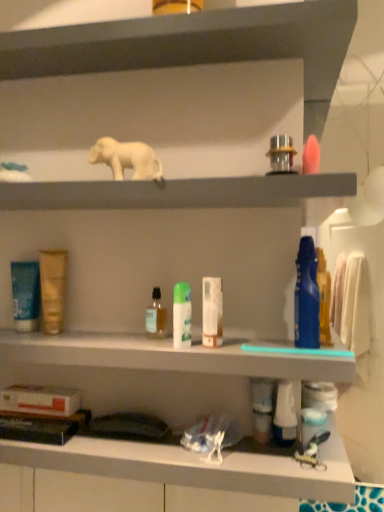
How much space does translucent plastic bottle at center, marked as the second mouthwash in a right-to-left arrangement, occupy vertically?

It is 4.37 inches.

Identify the location of metallic silver faucet at upper center, which is counted as the 3th toiletry, starting from the right. (281, 155).

The height and width of the screenshot is (512, 384). Describe the element at coordinates (193, 42) in the screenshot. I see `matte gray shelf at upper center, the 1th shelf when ordered from top to bottom` at that location.

Describe the element at coordinates (25, 295) in the screenshot. The image size is (384, 512). I see `blue matte tube at left, the first toiletry positioned from the left` at that location.

The height and width of the screenshot is (512, 384). What are the coordinates of `matte gold tube at center left, the 6th toiletry positioned from the right` in the screenshot? It's located at (53, 288).

Find the location of `white matte tube at center, arranged as the 4th toiletry when viewed from the right`. white matte tube at center, arranged as the 4th toiletry when viewed from the right is located at coordinates (212, 312).

Find the location of `translucent plastic bottle at center, marked as the second mouthwash in a right-to-left arrangement`. translucent plastic bottle at center, marked as the second mouthwash in a right-to-left arrangement is located at coordinates (156, 317).

In terms of size, does white matte box at lower center appear bigger or smaller than translucent plastic bottle at center, which ranks as the 2th mouthwash in front-to-back order?

In the image, white matte box at lower center appears to be larger than translucent plastic bottle at center, which ranks as the 2th mouthwash in front-to-back order.

Which object is closer to the camera, white matte box at lower center or translucent plastic bottle at center, which ranks as the 2th mouthwash in front-to-back order?

white matte box at lower center is more forward.

Is point (21, 465) positioned after point (152, 325)?

Yes, point (21, 465) is farther from viewer.

Looking at this image, which of these two, white matte box at lower center or translucent plastic bottle at center, arranged as the 1th mouthwash when viewed from the left, is wider?

white matte box at lower center.

Locate an element on the screen. The image size is (384, 512). cabinet in front of the blue glossy mouthwash at center right, arranged as the 2th mouthwash when viewed from the back is located at coordinates (169, 356).

Based on their sizes in the image, would you say blue glossy mouthwash at center right, arranged as the 2th mouthwash when viewed from the back, is bigger or smaller than white plastic bottles at center?

blue glossy mouthwash at center right, arranged as the 2th mouthwash when viewed from the back, is smaller than white plastic bottles at center.

What's the angular difference between white matte box at lower center and metallic silver faucet at upper center, the fifth toiletry viewed from the left,'s facing directions?

There is a 0.000714-degree angle between the facing directions of white matte box at lower center and metallic silver faucet at upper center, the fifth toiletry viewed from the left.

Is white matte box at lower center facing away from metallic silver faucet at upper center, which is counted as the 3th toiletry, starting from the right?

That's not correct — white matte box at lower center is not looking away from metallic silver faucet at upper center, which is counted as the 3th toiletry, starting from the right.

Considering the sizes of white matte box at lower center and metallic silver faucet at upper center, the fifth toiletry viewed from the left, in the image, is white matte box at lower center wider or thinner than metallic silver faucet at upper center, the fifth toiletry viewed from the left,?

Considering their sizes, white matte box at lower center looks broader than metallic silver faucet at upper center, the fifth toiletry viewed from the left.

Does white matte box at lower center have a larger size compared to metallic silver faucet at upper center, the fifth toiletry viewed from the left?

Yes.

Is white plastic bottles at center inside or outside of white matte elephant at upper center, which is the second shelf from top to bottom?

white plastic bottles at center exists outside the volume of white matte elephant at upper center, which is the second shelf from top to bottom.

Which object is closer to the camera, white plastic bottles at center or white matte elephant at upper center, which is the second shelf from top to bottom?

Positioned in front is white plastic bottles at center.

From a real-world perspective, is white plastic bottles at center above or below white matte elephant at upper center, which is the second shelf from top to bottom?

Clearly, from a real-world perspective, white plastic bottles at center is below white matte elephant at upper center, which is the second shelf from top to bottom.

Which is more to the left, white plastic bottles at center or white matte elephant at upper center, which is the second shelf from top to bottom?

white matte elephant at upper center, which is the second shelf from top to bottom, is more to the left.

Is white matte elephant at upper center wider or thinner than white matte tube at center, the fourth toiletry when ordered from left to right?

In the image, white matte elephant at upper center appears to be wider than white matte tube at center, the fourth toiletry when ordered from left to right.

Is white matte elephant at upper center aimed at white matte tube at center, the fourth toiletry when ordered from left to right?

No, white matte elephant at upper center does not turn towards white matte tube at center, the fourth toiletry when ordered from left to right.

In order to click on the 2nd toiletry in front of the white matte elephant at upper center, counting from the anchor's position in this screenshot , I will do pos(212,312).

Can you confirm if white matte elephant at upper center is bigger than white matte tube at center, arranged as the 4th toiletry when viewed from the right?

Correct, white matte elephant at upper center is larger in size than white matte tube at center, arranged as the 4th toiletry when viewed from the right.

Does green matte spray can at center, marked as the fifth toiletry in a right-to-left arrangement, have a larger size compared to white plastic toothpaste tube at lower center, the 2th toiletry in the right-to-left sequence?

Incorrect, green matte spray can at center, marked as the fifth toiletry in a right-to-left arrangement, is not larger than white plastic toothpaste tube at lower center, the 2th toiletry in the right-to-left sequence.

At what (x,y) coordinates should I click in order to perform the action: click on the 3rd toiletry counting from the left of the white plastic toothpaste tube at lower center, the 2th toiletry in the right-to-left sequence. Please return your answer as a coordinate pair (x, y). This screenshot has width=384, height=512. Looking at the image, I should click on (182, 315).

Does green matte spray can at center, which is the third toiletry in left-to-right order, touch white plastic toothpaste tube at lower center, the 6th toiletry in the left-to-right sequence?

No, green matte spray can at center, which is the third toiletry in left-to-right order, is not in contact with white plastic toothpaste tube at lower center, the 6th toiletry in the left-to-right sequence.

From a real-world perspective, who is located higher, green matte spray can at center, marked as the fifth toiletry in a right-to-left arrangement, or white plastic toothpaste tube at lower center, the 2th toiletry in the right-to-left sequence?

green matte spray can at center, marked as the fifth toiletry in a right-to-left arrangement, is physically above.

From the image's perspective, is white matte elephant at upper center, placed as the 1th shelf when sorted from bottom to top, located above or below matte gold tube at center left, the 6th toiletry positioned from the right?

white matte elephant at upper center, placed as the 1th shelf when sorted from bottom to top, is situated higher than matte gold tube at center left, the 6th toiletry positioned from the right, in the image.

From a real-world perspective, between white matte elephant at upper center, which is the second shelf from top to bottom, and matte gold tube at center left, which is the 2th toiletry from left to right, who is vertically lower?

matte gold tube at center left, which is the 2th toiletry from left to right.

Looking at this image, does white matte elephant at upper center, which is the second shelf from top to bottom, turn towards matte gold tube at center left, the 6th toiletry positioned from the right?

No.

I want to click on counter top in front of the translucent plastic bottle at center, marked as the second mouthwash in a right-to-left arrangement, so click(x=192, y=467).

From the image's perspective, count 2nd mouthwashs upward from the white plastic bottles at center and point to it. Please provide its 2D coordinates.

[(306, 297)]

From the picture: When comparing their distances from translucent plastic bottle at center, marked as the second mouthwash in a right-to-left arrangement, does matte gold tube at center left, the 6th toiletry positioned from the right, or white plastic toothpaste tube at lower center, the 2th toiletry in the right-to-left sequence, seem closer?

Based on the image, matte gold tube at center left, the 6th toiletry positioned from the right, appears to be nearer to translucent plastic bottle at center, marked as the second mouthwash in a right-to-left arrangement.

Looking at this image, when comparing their distances from matte gold tube at center left, which is the 2th toiletry from left to right, does blue glossy mouthwash at center right, arranged as the 2th mouthwash when viewed from the back, or white matte elephant at upper center seem further?

blue glossy mouthwash at center right, arranged as the 2th mouthwash when viewed from the back, lies further to matte gold tube at center left, which is the 2th toiletry from left to right, than the other object.

Based on their spatial positions, is white matte elephant at upper center or blue glossy mouthwash at center right, arranged as the 2th mouthwash when viewed from the back, further from white matte tube at center, the fourth toiletry when ordered from left to right?

Based on the image, white matte elephant at upper center appears to be further to white matte tube at center, the fourth toiletry when ordered from left to right.

When comparing their distances from matte gray shelf at upper center, the 2th shelf ordered from the bottom, does white matte elephant at upper center or blue matte tube at left, arranged as the 7th toiletry when viewed from the right, seem further?

blue matte tube at left, arranged as the 7th toiletry when viewed from the right, lies further to matte gray shelf at upper center, the 2th shelf ordered from the bottom, than the other object.

When comparing their distances from white matte elephant at upper center, does blue glossy toothpaste at right, which ranks as the 1th toiletry in right-to-left order, or blue glossy mouthwash at center right, the 2th mouthwash positioned from the left, seem further?

The object further to white matte elephant at upper center is blue glossy toothpaste at right, which ranks as the 1th toiletry in right-to-left order.

From the image, which object appears to be farther from blue glossy toothpaste at right, which appears as the 7th toiletry when viewed from the left, green matte spray can at center, marked as the fifth toiletry in a right-to-left arrangement, or blue glossy mouthwash at center right, which is the 1th mouthwash in right-to-left order?

A: green matte spray can at center, marked as the fifth toiletry in a right-to-left arrangement.

Looking at the image, which one is located closer to matte gold tube at center left, which is the 2th toiletry from left to right, blue glossy mouthwash at center right, arranged as the 2th mouthwash when viewed from the back, or white matte box at lower center?

Among the two, white matte box at lower center is located nearer to matte gold tube at center left, which is the 2th toiletry from left to right.

From the image, which object appears to be farther from blue matte tube at left, arranged as the 7th toiletry when viewed from the right, white matte box at lower center or white matte elephant at upper center?

The object further to blue matte tube at left, arranged as the 7th toiletry when viewed from the right, is white matte box at lower center.

This screenshot has width=384, height=512. Identify the location of toiletry between matte gray shelf at upper center, the 2th shelf ordered from the bottom, and blue glossy toothpaste at right, which appears as the 7th toiletry when viewed from the left, from top to bottom. (281, 155).

You are a GUI agent. You are given a task and a screenshot of the screen. Output one action in this format:
    pyautogui.click(x=<x>, y=<y>)
    Task: Click on the shelf between white matte elephant at upper center and white plastic bottles at center vertically
    This screenshot has width=384, height=512.
    Given the screenshot: What is the action you would take?
    pyautogui.click(x=184, y=193)

You are a GUI agent. You are given a task and a screenshot of the screen. Output one action in this format:
    pyautogui.click(x=<x>, y=<y>)
    Task: Click on the animal between white matte elephant at upper center, placed as the 1th shelf when sorted from bottom to top, and blue glossy mouthwash at center right, the 1th mouthwash from the front, in the horizontal direction
    This screenshot has height=512, width=384.
    Given the screenshot: What is the action you would take?
    pyautogui.click(x=126, y=158)

Where is `cabinet between blue matte tube at left, the first toiletry positioned from the left, and blue glossy mouthwash at center right, the 1th mouthwash from the front, from left to right`? The width and height of the screenshot is (384, 512). cabinet between blue matte tube at left, the first toiletry positioned from the left, and blue glossy mouthwash at center right, the 1th mouthwash from the front, from left to right is located at coordinates (169, 356).